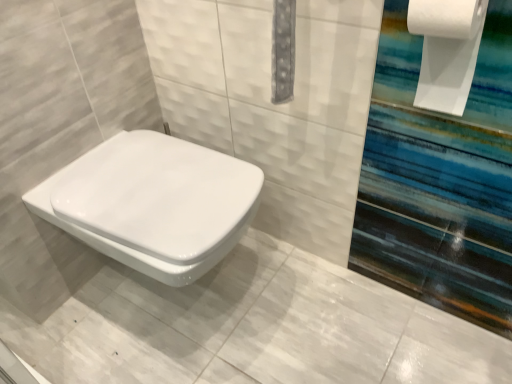
The width and height of the screenshot is (512, 384). What do you see at coordinates (153, 203) in the screenshot? I see `white glossy toilet at center` at bounding box center [153, 203].

This screenshot has height=384, width=512. Find the location of `white glossy toilet at center`. white glossy toilet at center is located at coordinates (153, 203).

At what (x,y) coordinates should I click in order to perform the action: click on white glossy toilet at center. Please return your answer as a coordinate pair (x, y). Looking at the image, I should click on (153, 203).